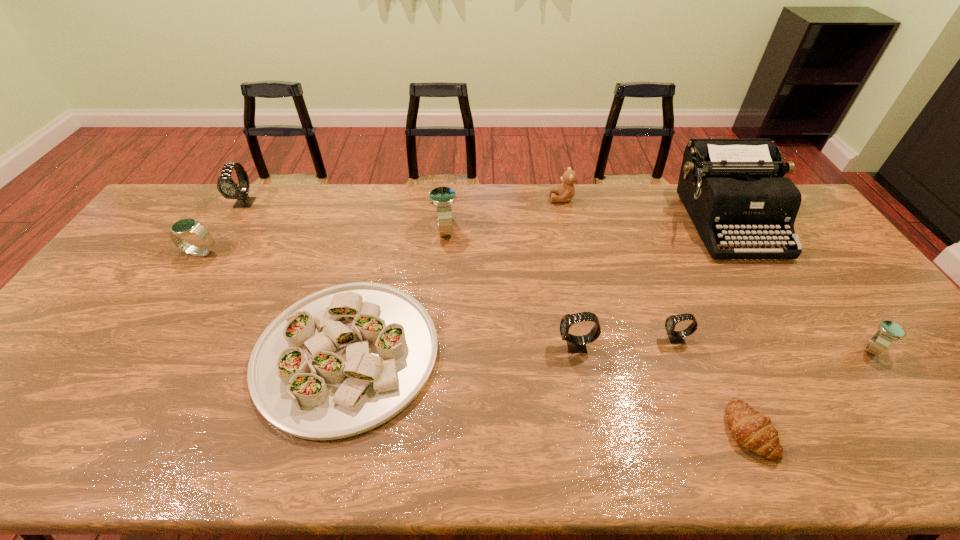
Locate which blue watch is the second closest to the second farthest watch. Please provide its 2D coordinates. Your answer should be formatted as a tuple, i.e. [(x, y)], where the tuple contains the x and y coordinates of a point satisfying the conditions above.

[(889, 331)]

Find the location of a particular element. The width and height of the screenshot is (960, 540). blank area in the image that satisfies the following two spatial constraints: 1. on the typing side of the typewriter; 2. on the face of the second smallest gray watch is located at coordinates (802, 346).

The height and width of the screenshot is (540, 960). What are the coordinates of `vacant space that satisfies the following two spatial constraints: 1. on the back side of the brown crescent roll; 2. on the face of the brown teddy bear` in the screenshot? It's located at (646, 199).

The height and width of the screenshot is (540, 960). I want to click on vacant space that satisfies the following two spatial constraints: 1. on the face of the brown teddy bear; 2. on the front side of the platter, so click(595, 354).